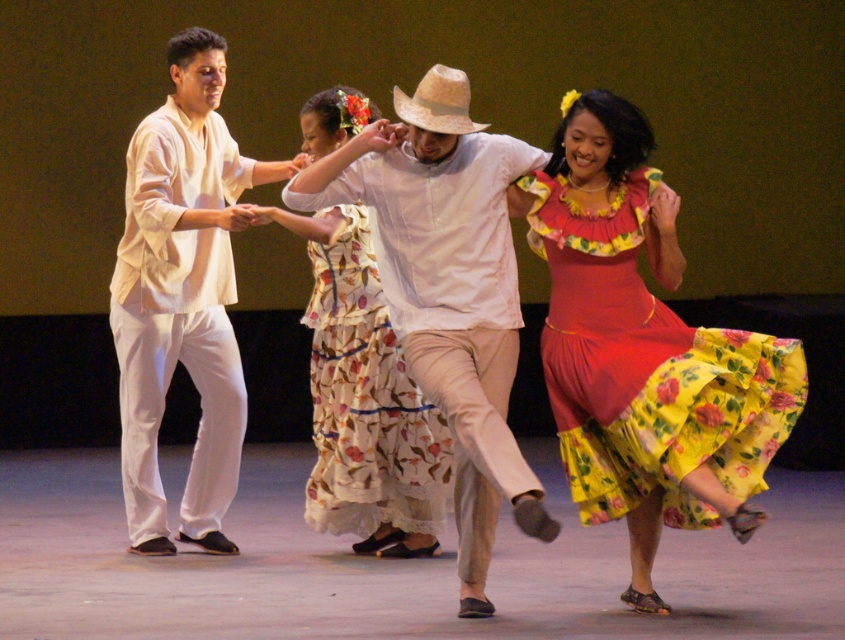
Looking at this image, you are standing at point (755, 436) and want to reach the stage entrance located at the opposite side of the dancers. The dancers are 5.24 meters away from you. If you walk straight towards the entrance, will you collide with any of the dancers?

The dancers are 5.24 meters away from you at point (755, 436). Since you are walking straight towards the stage entrance on the opposite side, you will pass by the dancers who are in your path, so there will be a collision.

You are a photographer positioned at the center of the stage. You need to capture a photo where both the floral cotton dress at right and the matte white shirt at center are visible. Based on their positions, which direction should you pan your camera to include both subjects?

The floral cotton dress at right is to the right of the matte white shirt at center. To include both subjects in the photo, you should pan your camera to the right to capture the floral cotton dress at right and keep the matte white shirt at center in frame.

You are a photographer positioned at the camera. You see two points in the scene, point (780,356) and point (437,74). Which point is nearer to your position?

Point (780,356) is closer to the camera than point (437,74).